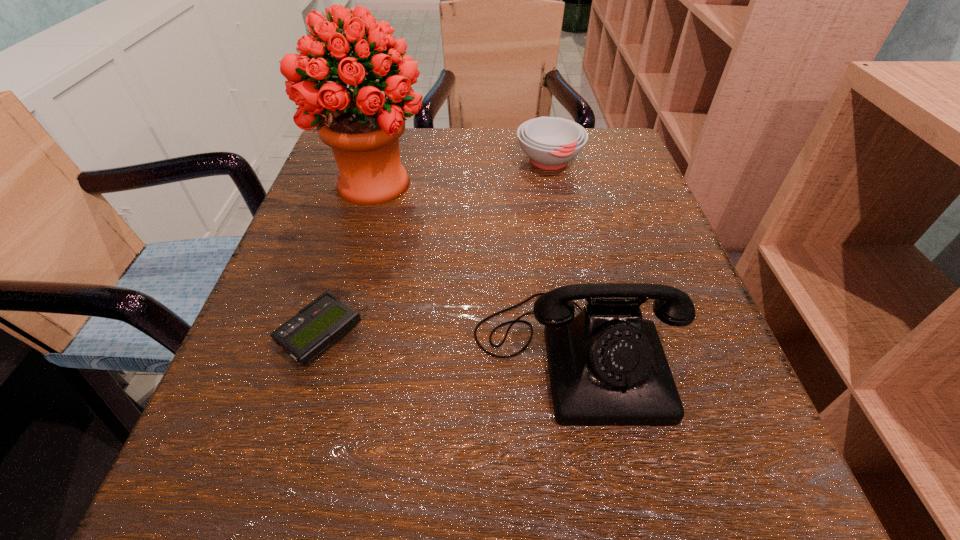
At what (x,y) coordinates should I click in order to perform the action: click on the tallest object. Please return your answer as a coordinate pair (x, y). Image resolution: width=960 pixels, height=540 pixels. Looking at the image, I should click on (362, 127).

Find the location of a particular element. The height and width of the screenshot is (540, 960). the second tallest object is located at coordinates (607, 367).

Where is `the second shortest object`? This screenshot has height=540, width=960. the second shortest object is located at coordinates 550,142.

At what (x,y) coordinates should I click in order to perform the action: click on the shortest object. Please return your answer as a coordinate pair (x, y). The width and height of the screenshot is (960, 540). Looking at the image, I should click on (317, 326).

In order to click on free space located 0.380m on the right of the bouquet in this screenshot , I will do `click(619, 184)`.

Find the location of a particular element. free location located 0.080m on the front face of the third shortest object is located at coordinates (603, 497).

This screenshot has height=540, width=960. In order to click on free region located on the front of the soup bowl in this screenshot , I will do `click(561, 217)`.

Locate an element on the screen. This screenshot has width=960, height=540. free location located 0.110m on the front of the shortest object is located at coordinates (284, 454).

Image resolution: width=960 pixels, height=540 pixels. I want to click on bouquet at the far edge, so point(362,127).

Where is `soup bowl at the far edge`? soup bowl at the far edge is located at coordinates (550, 142).